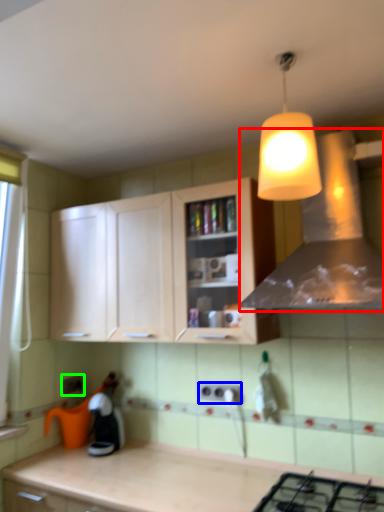
Question: Which object is positioned farthest from vent (highlighted by a red box)? Select from electric outlet (highlighted by a blue box) and electric outlet (highlighted by a green box).

Choices:
 (A) electric outlet
 (B) electric outlet

Answer: (B)